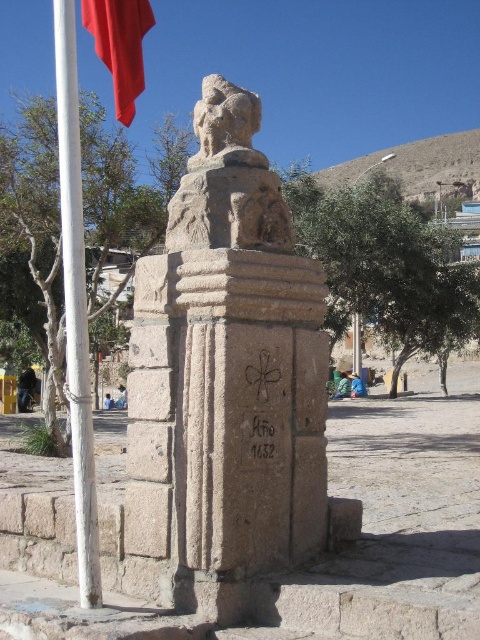
Question: Is red fabric flag at upper left smaller than black stone writing at center?

Choices:
 (A) no
 (B) yes

Answer: (A)

Question: Is stone statue at center positioned in front of black stone writing at center?

Choices:
 (A) no
 (B) yes

Answer: (B)

Question: Which point appears closest to the camera in this image?

Choices:
 (A) (67, 72)
 (B) (85, 20)

Answer: (A)

Question: Which of the following is the closest to the observer?

Choices:
 (A) red fabric flag at upper left
 (B) stone statue at center

Answer: (B)

Question: Is stone statue at center to the left of red fabric flag at upper left from the viewer's perspective?

Choices:
 (A) yes
 (B) no

Answer: (B)

Question: Which point is closer to the camera?

Choices:
 (A) (233, 516)
 (B) (62, 202)

Answer: (B)